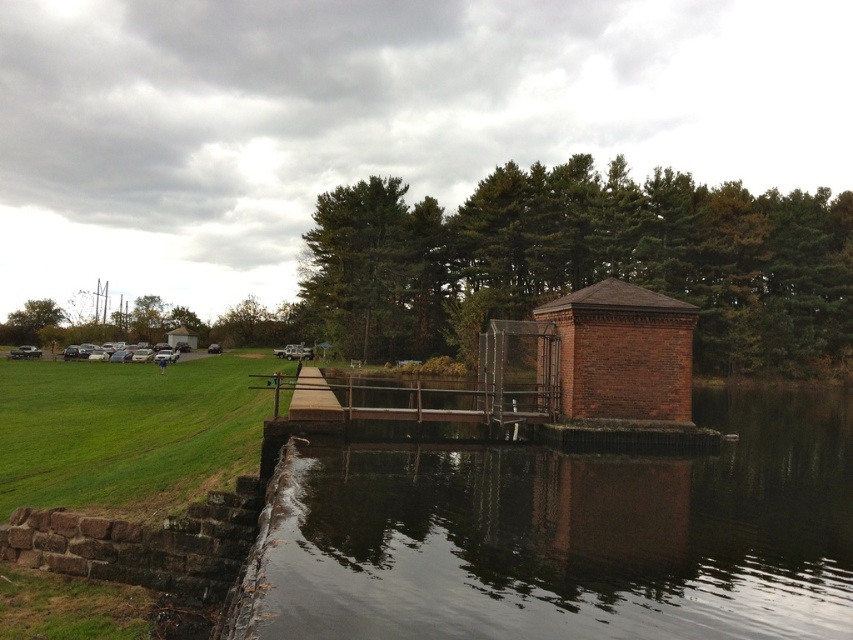
Question: Is brick gazebo at center in front of brown wooden dock at center?

Choices:
 (A) no
 (B) yes

Answer: (A)

Question: Based on their relative distances, which object is nearer to the brick gazebo at center?

Choices:
 (A) brown wooden dock at center
 (B) dark reflective water at center

Answer: (B)

Question: Among these points, which one is farthest from the camera?

Choices:
 (A) coord(549,316)
 (B) coord(322,374)
 (C) coord(567,568)

Answer: (B)

Question: Can you confirm if dark reflective water at center is positioned to the left of brick gazebo at center?

Choices:
 (A) no
 (B) yes

Answer: (A)

Question: Does dark reflective water at center appear over brick gazebo at center?

Choices:
 (A) yes
 (B) no

Answer: (B)

Question: Which object is farther from the camera taking this photo?

Choices:
 (A) brown wooden dock at center
 (B) brick gazebo at center
 (C) dark reflective water at center

Answer: (B)